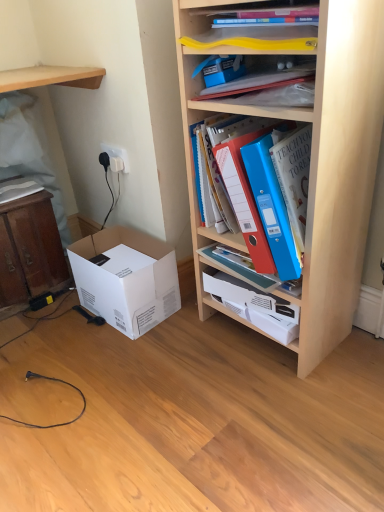
Measure the distance between point (187, 91) and camera.

Point (187, 91) is 1.07 meters away from camera.

Find the location of a particular element. blue plastic folders at center is located at coordinates (254, 305).

Can you confirm if blue plastic binder at upper center, the third book in the left-to-right sequence, is shorter than white cardboard box at lower left?

In fact, blue plastic binder at upper center, the third book in the left-to-right sequence, may be taller than white cardboard box at lower left.

Does blue plastic binder at upper center, which is counted as the 1th book, starting from the right, have a greater width compared to white cardboard box at lower left?

No.

Looking at the image, does blue plastic binder at upper center, which is counted as the 1th book, starting from the right, seem bigger or smaller compared to white cardboard box at lower left?

Considering their sizes, blue plastic binder at upper center, which is counted as the 1th book, starting from the right, takes up less space than white cardboard box at lower left.

From a real-world perspective, is blue plastic binder at upper center, the third book in the left-to-right sequence, positioned above or below white cardboard box at lower left?

From a real-world perspective, blue plastic binder at upper center, the third book in the left-to-right sequence, is physically above white cardboard box at lower left.

From a real-world perspective, is blue plastic folder at upper center, which appears as the second book when viewed from the left, positioned above or below blue plastic folder at upper center?

Clearly, from a real-world perspective, blue plastic folder at upper center, which appears as the second book when viewed from the left, is above blue plastic folder at upper center.

Is blue plastic folder at upper center, which is counted as the second book, starting from the right, at the left side of blue plastic folder at upper center?

Incorrect, blue plastic folder at upper center, which is counted as the second book, starting from the right, is not on the left side of blue plastic folder at upper center.

Measure the distance from blue plastic folder at upper center, which appears as the second book when viewed from the left, to blue plastic folder at upper center.

A distance of 6.90 inches exists between blue plastic folder at upper center, which appears as the second book when viewed from the left, and blue plastic folder at upper center.

Which is correct: blue plastic folder at upper center, which appears as the second book when viewed from the left, is inside blue plastic folder at upper center, or outside of it?

blue plastic folder at upper center, which appears as the second book when viewed from the left, lies outside blue plastic folder at upper center.

From the image's perspective, which object appears higher, blue plastic binder at upper center, the third book in the left-to-right sequence, or wooden cabinet at left?

blue plastic binder at upper center, the third book in the left-to-right sequence, appears higher in the image.

In the scene shown: Measure the distance from blue plastic binder at upper center, which is counted as the 1th book, starting from the right, to wooden cabinet at left.

blue plastic binder at upper center, which is counted as the 1th book, starting from the right, and wooden cabinet at left are 34.21 inches apart.

Identify the location of the 2nd book to the right of the wooden cabinet at left, counting from the anchor's position. (277, 190).

Consider the image. Considering the sizes of objects blue plastic binder at upper center, the third book in the left-to-right sequence, and wooden cabinet at left in the image provided, who is bigger, blue plastic binder at upper center, the third book in the left-to-right sequence, or wooden cabinet at left?

wooden cabinet at left.

Is blue plastic folder at upper center smaller than blue plastic folders at center?

Yes.

Does blue plastic folder at upper center have a greater width compared to blue plastic folders at center?

In fact, blue plastic folder at upper center might be narrower than blue plastic folders at center.

Where is `cabinet below the blue plastic folder at upper center (from the image's perspective)`? The width and height of the screenshot is (384, 512). cabinet below the blue plastic folder at upper center (from the image's perspective) is located at coordinates (254, 305).

Is blue plastic folder at upper center situated inside blue plastic folders at center or outside?

blue plastic folder at upper center is not inside blue plastic folders at center, it's outside.

Would you consider white plastic electric outlet at upper left to be distant from white paper at left, which is the first book from left to right?

No.

I want to click on book that is the 1st one when counting forward from the white plastic electric outlet at upper left, so click(18, 189).

Is point (123, 151) in front of point (25, 185)?

Yes.

Can you confirm if white plastic electric outlet at upper left is taller than white paper at left, which is the first book from left to right?

Indeed, white plastic electric outlet at upper left has a greater height compared to white paper at left, which is the first book from left to right.

Would you say blue plastic folders at center contains wooden cabinet at left?

No, blue plastic folders at center does not contain wooden cabinet at left.

Are blue plastic folders at center and wooden cabinet at left located far from each other?

blue plastic folders at center is actually quite close to wooden cabinet at left.

Does blue plastic folders at center have a lesser width compared to wooden cabinet at left?

Yes, blue plastic folders at center is thinner than wooden cabinet at left.

Is blue plastic folders at center aimed at wooden cabinet at left?

No, blue plastic folders at center is not aimed at wooden cabinet at left.

Is white plastic electric outlet at upper left not inside blue plastic binder at upper center, the third book in the left-to-right sequence?

white plastic electric outlet at upper left is positioned outside blue plastic binder at upper center, the third book in the left-to-right sequence.

Which object is thinner, white plastic electric outlet at upper left or blue plastic binder at upper center, which is counted as the 1th book, starting from the right?

white plastic electric outlet at upper left is thinner.

At what (x,y) coordinates should I click in order to perform the action: click on book that is the 2nd object located below the white plastic electric outlet at upper left (from the image's perspective). Please return your answer as a coordinate pair (x, y). This screenshot has width=384, height=512. Looking at the image, I should click on (277, 190).

Find the location of a particular element. The height and width of the screenshot is (512, 384). the 2nd book to the right of the white cardboard box at lower left, counting from the anchor's position is located at coordinates (277, 190).

Image resolution: width=384 pixels, height=512 pixels. I want to click on book that is the 2nd object above the blue plastic folder at upper center (from a real-world perspective), so click(268, 87).

From the image, which object appears to be farther from wooden shelf at upper left, positioned as the 1th shelf in left-to-right order, wooden bookshelf at upper right, the first shelf in the right-to-left sequence, or white cardboard box at lower left?

wooden bookshelf at upper right, the first shelf in the right-to-left sequence.

Considering their positions, is wooden cabinet at left positioned closer to blue plastic folders at center than white paper at left, placed as the third book when sorted from right to left?

wooden cabinet at left is positioned closer to the anchor blue plastic folders at center.

Considering their positions, is white paper at left, which is the first book from left to right, positioned closer to wooden shelf at upper left, arranged as the 2th shelf when viewed from the right, than blue plastic folder at upper center, which is counted as the second book, starting from the right?

Among the two, white paper at left, which is the first book from left to right, is located nearer to wooden shelf at upper left, arranged as the 2th shelf when viewed from the right.

From the image, which object appears to be nearer to blue plastic binder at upper center, which is counted as the 1th book, starting from the right, blue plastic folders at center or white paper at left, placed as the third book when sorted from right to left?

Among the two, blue plastic folders at center is located nearer to blue plastic binder at upper center, which is counted as the 1th book, starting from the right.

When comparing their distances from white plastic electric outlet at upper left, does blue plastic folders at center or white paper at left, placed as the third book when sorted from right to left, seem further?

blue plastic folders at center.

When comparing their distances from wooden bookshelf at upper right, which is the 2th shelf from left to right, does wooden cabinet at left or blue plastic folder at upper center, which appears as the second book when viewed from the left, seem further?

wooden cabinet at left is further to wooden bookshelf at upper right, which is the 2th shelf from left to right.

When comparing their distances from white plastic electric outlet at upper left, does blue plastic folder at upper center, which appears as the second book when viewed from the left, or wooden shelf at upper left, arranged as the 2th shelf when viewed from the right, seem further?

The object further to white plastic electric outlet at upper left is blue plastic folder at upper center, which appears as the second book when viewed from the left.

Which object lies nearer to the anchor point blue plastic folder at upper center, white paper at left, placed as the third book when sorted from right to left, or white cardboard box at lower left?

Based on the image, white cardboard box at lower left appears to be nearer to blue plastic folder at upper center.

Image resolution: width=384 pixels, height=512 pixels. I want to click on book between blue plastic folder at upper center and blue plastic folders at center in the vertical direction, so click(x=277, y=190).

Find the location of a particular element. The width and height of the screenshot is (384, 512). electric outlet situated between wooden shelf at upper left, positioned as the 1th shelf in left-to-right order, and blue plastic folders at center from left to right is located at coordinates (117, 154).

You are a GUI agent. You are given a task and a screenshot of the screen. Output one action in this format:
    pyautogui.click(x=<x>, y=<y>)
    Task: Click on the book between blue plastic binder at upper center, which is counted as the 1th book, starting from the right, and white cardboard box at lower left in the front-back direction
    
    Given the screenshot: What is the action you would take?
    pyautogui.click(x=268, y=87)

Image resolution: width=384 pixels, height=512 pixels. Find the location of `box situated between white paper at left, placed as the third book when sorted from right to left, and blue plastic binder at upper center, which is counted as the 1th book, starting from the right, from left to right`. box situated between white paper at left, placed as the third book when sorted from right to left, and blue plastic binder at upper center, which is counted as the 1th book, starting from the right, from left to right is located at coordinates (126, 278).